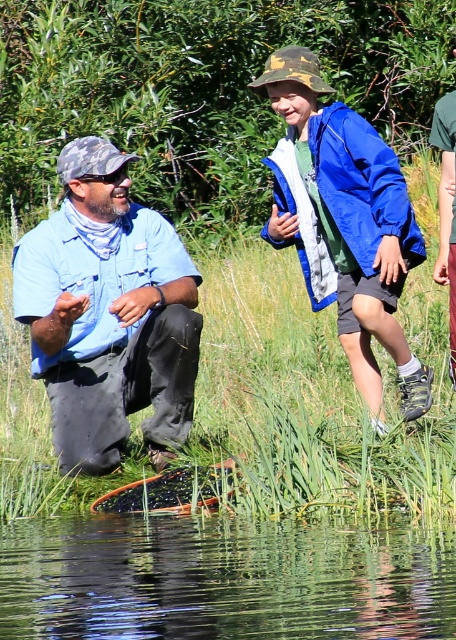
Who is shorter, blue denim shirt at left or blue fabric jacket at upper center?

With less height is blue fabric jacket at upper center.

Who is positioned more to the left, blue denim shirt at left or blue fabric jacket at upper center?

blue denim shirt at left is more to the left.

Where is `blue denim shirt at left`? This screenshot has width=456, height=640. blue denim shirt at left is located at coordinates (108, 314).

The image size is (456, 640). I want to click on blue denim shirt at left, so click(x=108, y=314).

Is point (245, 586) less distant than point (84, 240)?

Yes, it is.

Is clear water at lower left further to the viewer compared to blue denim shirt at left?

No, clear water at lower left is closer to the viewer.

Who is more forward, (22, 554) or (118, 428)?

Point (22, 554)

I want to click on clear water at lower left, so click(223, 579).

Which is more to the left, blue matte jacket at upper center or blue fabric jacket at upper center?

blue matte jacket at upper center

Is point (342, 182) positioned after point (455, 227)?

That is True.

Where is `blue matte jacket at upper center`? blue matte jacket at upper center is located at coordinates (345, 224).